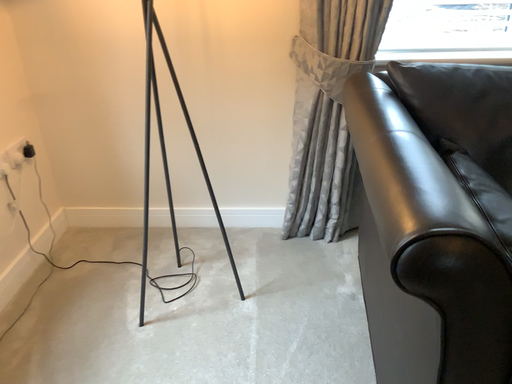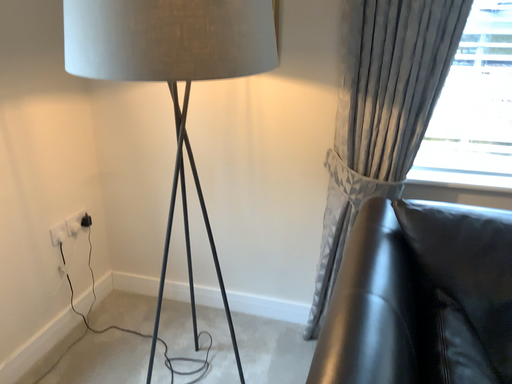
Question: How did the camera likely rotate when shooting the video?

Choices:
 (A) rotated right
 (B) rotated left

Answer: (B)